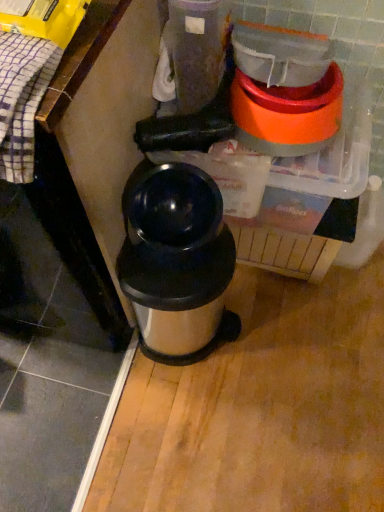
Question: Does point (168, 245) appear closer or farther from the camera than point (292, 90)?

Choices:
 (A) farther
 (B) closer

Answer: (B)

Question: From a real-world perspective, relative to orange plastic blender at upper right, is stainless steel thermos at center vertically above or below?

Choices:
 (A) below
 (B) above

Answer: (A)

Question: Visually, is stainless steel thermos at center positioned to the left or to the right of orange plastic blender at upper right?

Choices:
 (A) left
 (B) right

Answer: (A)

Question: In terms of height, does orange plastic blender at upper right look taller or shorter compared to stainless steel thermos at center?

Choices:
 (A) short
 (B) tall

Answer: (A)

Question: Looking at the image, does orange plastic blender at upper right seem bigger or smaller compared to stainless steel thermos at center?

Choices:
 (A) small
 (B) big

Answer: (A)

Question: Considering the relative positions of orange plastic blender at upper right and stainless steel thermos at center in the image provided, is orange plastic blender at upper right to the left or to the right of stainless steel thermos at center?

Choices:
 (A) right
 (B) left

Answer: (A)

Question: From a real-world perspective, is orange plastic blender at upper right positioned above or below stainless steel thermos at center?

Choices:
 (A) below
 (B) above

Answer: (B)